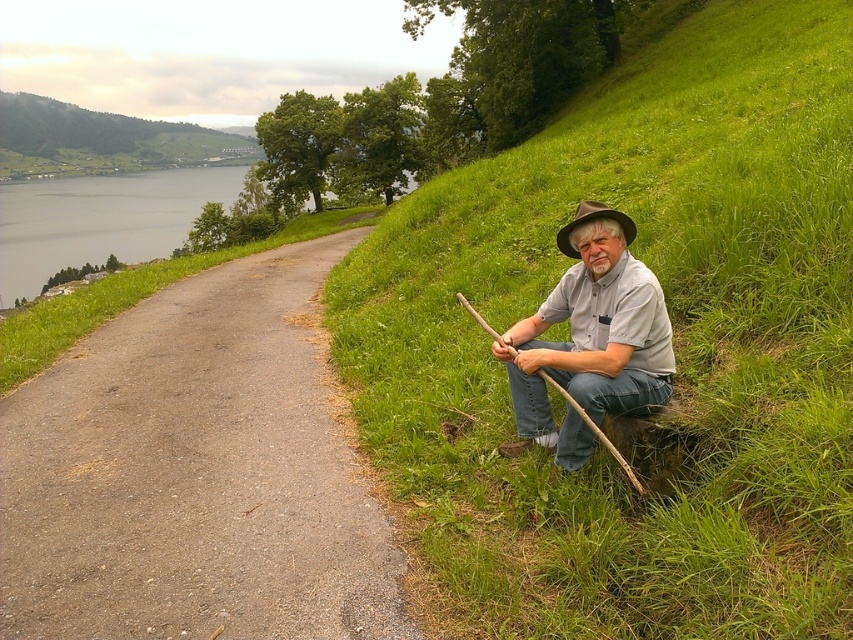
Does green grassy hillside at right have a smaller size compared to green grassy hillside at upper left?

Indeed, green grassy hillside at right has a smaller size compared to green grassy hillside at upper left.

Describe the element at coordinates (672, 346) in the screenshot. This screenshot has height=640, width=853. I see `green grassy hillside at right` at that location.

The image size is (853, 640). I want to click on green grassy hillside at right, so click(x=672, y=346).

Which is below, gray asphalt road at center or green grassy hillside at upper left?

Positioned lower is gray asphalt road at center.

Between point (366, 545) and point (186, 145), which one is positioned behind?

The point (186, 145) is more distant.

Who is more forward, (x=10, y=632) or (x=183, y=131)?

Point (x=10, y=632) is in front.

You are a GUI agent. You are given a task and a screenshot of the screen. Output one action in this format:
    pyautogui.click(x=<x>, y=<y>)
    Task: Click on the gray asphalt road at center
    The width and height of the screenshot is (853, 640).
    Given the screenshot: What is the action you would take?
    pyautogui.click(x=196, y=474)

Is green grassy hillside at upper left further to the viewer compared to brown felt hat at right?

Yes, green grassy hillside at upper left is further from the viewer.

Is point (3, 131) positioned after point (627, 227)?

Yes, it is behind point (627, 227).

This screenshot has width=853, height=640. I want to click on green grassy hillside at upper left, so click(x=103, y=140).